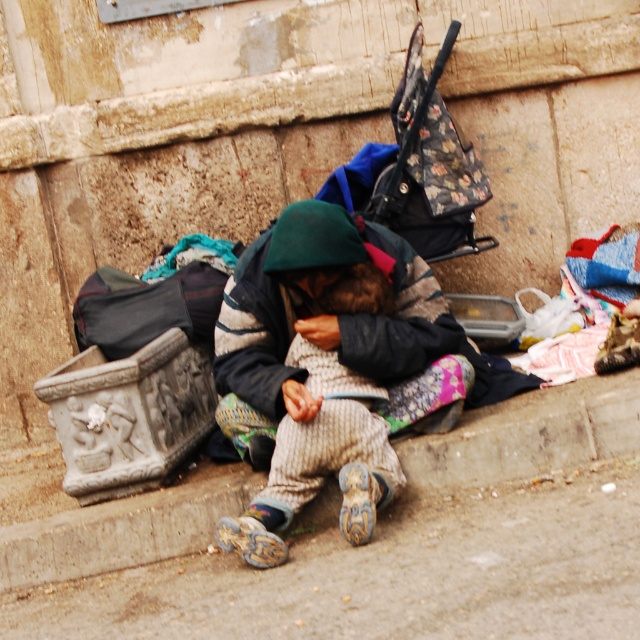
Who is lower down, brown concrete pavement at lower center or knitted woolen sweater at center?

brown concrete pavement at lower center is lower down.

Is brown concrete pavement at lower center thinner than knitted woolen sweater at center?

In fact, brown concrete pavement at lower center might be wider than knitted woolen sweater at center.

This screenshot has height=640, width=640. What do you see at coordinates (388, 573) in the screenshot?
I see `brown concrete pavement at lower center` at bounding box center [388, 573].

Find the location of a particular element. This screenshot has height=640, width=640. brown concrete pavement at lower center is located at coordinates (388, 573).